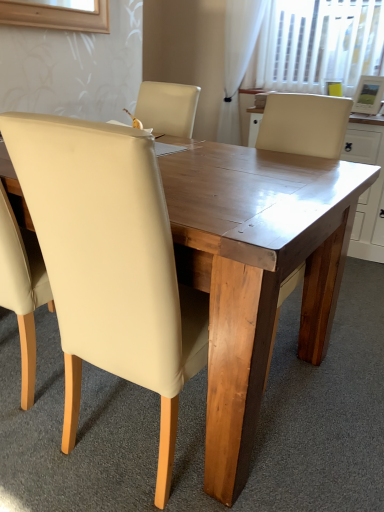
In order to face white sheer curtain at upper right, should I rotate leftwards or rightwards?

To align with it, rotate right about 7.598°.

Where is `white sheer curtain at upper right`? white sheer curtain at upper right is located at coordinates click(237, 61).

What do you see at coordinates (237, 61) in the screenshot? This screenshot has width=384, height=512. I see `white sheer curtain at upper right` at bounding box center [237, 61].

The image size is (384, 512). Describe the element at coordinates (110, 263) in the screenshot. I see `beige leather chair at center` at that location.

Locate an element on the screen. This screenshot has width=384, height=512. beige leather chair at center is located at coordinates (110, 263).

Identify the location of white sheer curtain at upper right. (237, 61).

Considering the relative positions of beige leather chair at center and white sheer curtain at upper right in the image provided, is beige leather chair at center to the left of white sheer curtain at upper right from the viewer's perspective?

Yes.

Does beige leather chair at center come in front of white sheer curtain at upper right?

Yes, the depth of beige leather chair at center is less than that of white sheer curtain at upper right.

Considering the points (123, 170) and (226, 17), which point is in front, point (123, 170) or point (226, 17)?

Positioned in front is point (123, 170).

From the image's perspective, which one is positioned higher, beige leather chair at center or white sheer curtain at upper right?

white sheer curtain at upper right.

From a real-world perspective, is beige leather chair at center beneath white sheer curtain at upper right?

Yes.

Which of these two, beige leather chair at center or white sheer curtain at upper right, is thinner?

white sheer curtain at upper right.

From the picture: Considering the sizes of beige leather chair at center and white sheer curtain at upper right in the image, is beige leather chair at center taller or shorter than white sheer curtain at upper right?

Considering their sizes, beige leather chair at center has less height than white sheer curtain at upper right.

Who is bigger, beige leather chair at center or white sheer curtain at upper right?

With larger size is beige leather chair at center.

Does beige leather chair at center contain white sheer curtain at upper right?

Definitely not — white sheer curtain at upper right is not inside beige leather chair at center.

Are beige leather chair at center and white sheer curtain at upper right beside each other?

beige leather chair at center and white sheer curtain at upper right are clearly separated.

Consider the image. Is beige leather chair at center oriented towards white sheer curtain at upper right?

Yes, beige leather chair at center is turned towards white sheer curtain at upper right.

Can you tell me how much beige leather chair at center and white sheer curtain at upper right differ in facing direction?

180 degrees separate the facing orientations of beige leather chair at center and white sheer curtain at upper right.

Identify the location of curtain above the beige leather chair at center (from the image's perspective). (237, 61).

Is white sheer curtain at upper right to the left or to the right of beige leather chair at center in the image?

Clearly, white sheer curtain at upper right is on the right of beige leather chair at center in the image.

In the image, is white sheer curtain at upper right positioned in front of or behind beige leather chair at center?

In the image, white sheer curtain at upper right appears behind beige leather chair at center.

Between point (220, 140) and point (33, 177), which one is positioned in front?

The point (33, 177) is closer to the camera.

From the image's perspective, is white sheer curtain at upper right over beige leather chair at center?

Yes, from the image's perspective, white sheer curtain at upper right is over beige leather chair at center.

From a real-world perspective, is white sheer curtain at upper right positioned above or below beige leather chair at center?

In terms of real-world spatial position, white sheer curtain at upper right is above beige leather chair at center.

Between white sheer curtain at upper right and beige leather chair at center, which one has smaller width?

white sheer curtain at upper right.

In the scene shown: Can you confirm if white sheer curtain at upper right is shorter than beige leather chair at center?

No, white sheer curtain at upper right is not shorter than beige leather chair at center.

Considering the sizes of white sheer curtain at upper right and beige leather chair at center in the image, is white sheer curtain at upper right bigger or smaller than beige leather chair at center?

In the image, white sheer curtain at upper right appears to be smaller than beige leather chair at center.

Is white sheer curtain at upper right located outside beige leather chair at center?

Yes, white sheer curtain at upper right is not within beige leather chair at center.

Is white sheer curtain at upper right positioned far away from beige leather chair at center?

Yes, white sheer curtain at upper right and beige leather chair at center are quite far apart.

Is white sheer curtain at upper right oriented away from beige leather chair at center?

No, beige leather chair at center is not at the back of white sheer curtain at upper right.

Can you tell me how much white sheer curtain at upper right and beige leather chair at center differ in facing direction?

The angle between the facing direction of white sheer curtain at upper right and the facing direction of beige leather chair at center is 180 degrees.

The image size is (384, 512). In order to click on curtain located above the beige leather chair at center (from a real-world perspective) in this screenshot , I will do `click(237, 61)`.

Locate an element on the screen. Image resolution: width=384 pixels, height=512 pixels. curtain on the right side of beige leather chair at center is located at coordinates click(x=237, y=61).

You are a GUI agent. You are given a task and a screenshot of the screen. Output one action in this format:
    pyautogui.click(x=<x>, y=<y>)
    Task: Click on the chair on the left of white sheer curtain at upper right
    This screenshot has width=384, height=512.
    Given the screenshot: What is the action you would take?
    pyautogui.click(x=110, y=263)